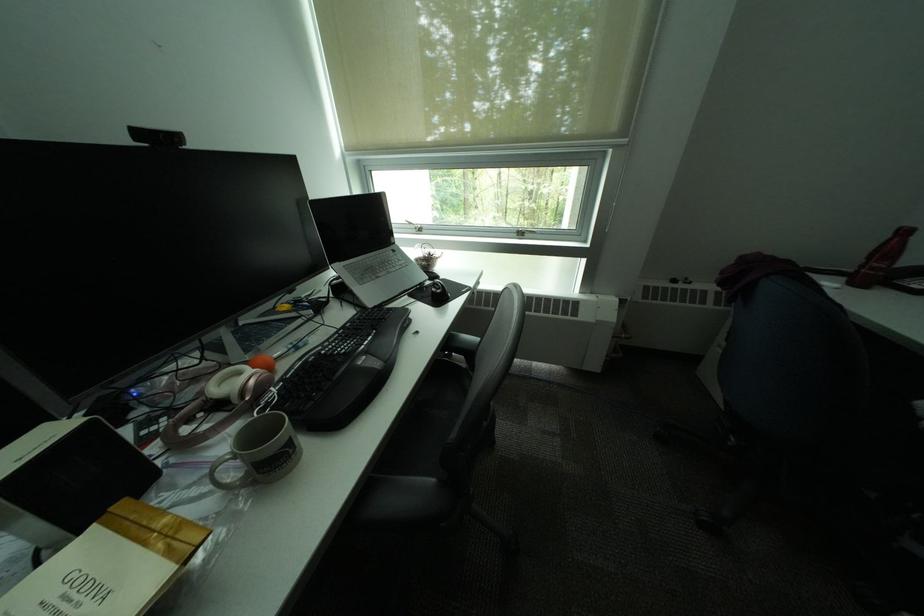
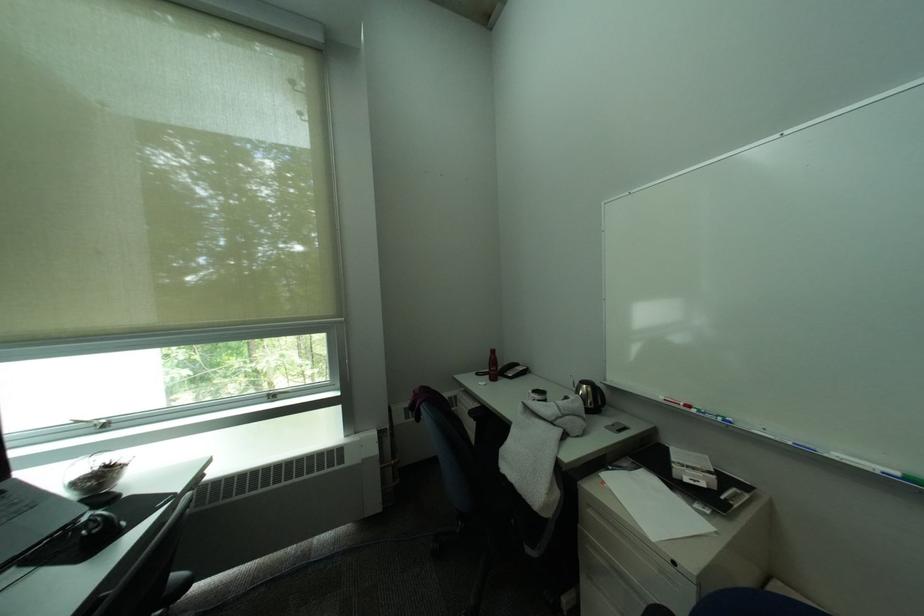
In the second image, find the point that corresponds to point 886,265 in the first image.

(503, 370)